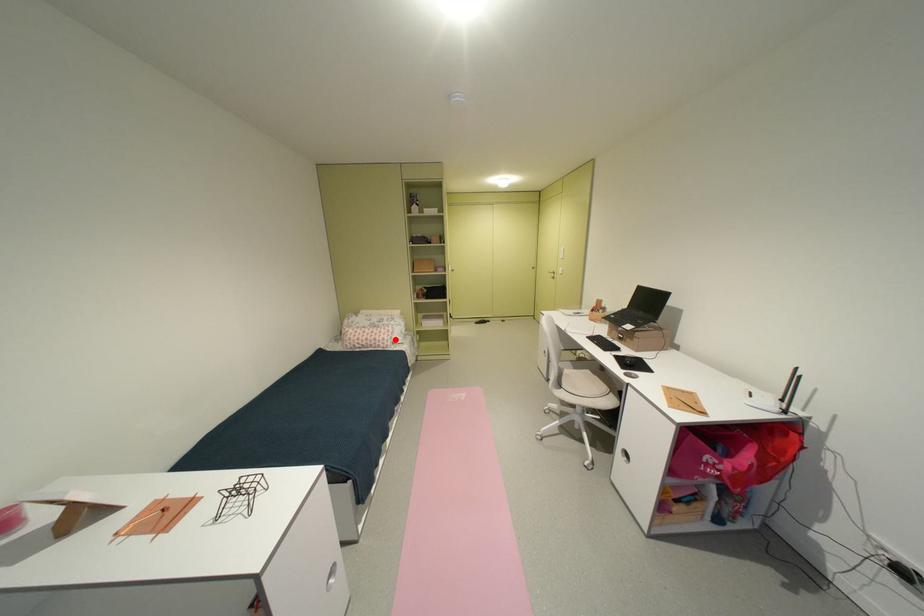
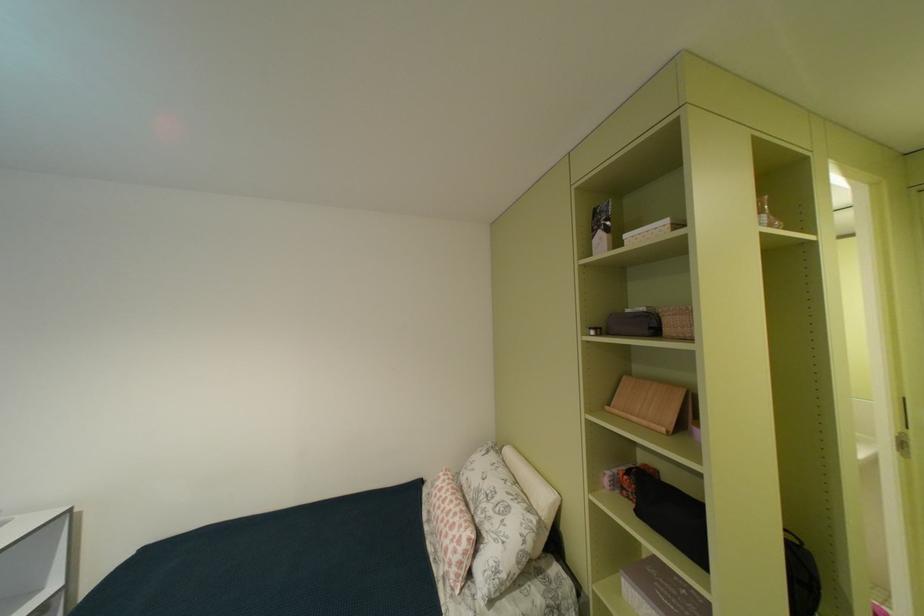
Question: I am providing you with two images of the same scene from different viewpoints. A red point is shown in image1. For the corresponding object point in image2, is it positioned nearer or farther from the camera?

Choices:
 (A) Nearer
 (B) Farther

Answer: (B)